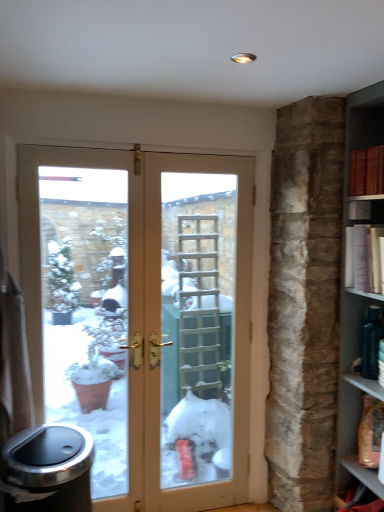
Question: Is red leather book at upper right, positioned as the 2th book in bottom-to-top order, at the right side of shiny metallic trash can at lower left?

Choices:
 (A) no
 (B) yes

Answer: (B)

Question: Is red leather book at upper right, positioned as the 2th book in bottom-to-top order, positioned before shiny metallic trash can at lower left?

Choices:
 (A) no
 (B) yes

Answer: (A)

Question: From a real-world perspective, is red leather book at upper right, the first book from the top, physically above shiny metallic trash can at lower left?

Choices:
 (A) no
 (B) yes

Answer: (B)

Question: From a real-world perspective, is red leather book at upper right, positioned as the 2th book in bottom-to-top order, located beneath shiny metallic trash can at lower left?

Choices:
 (A) no
 (B) yes

Answer: (A)

Question: Does red leather book at upper right, positioned as the 2th book in bottom-to-top order, have a smaller size compared to shiny metallic trash can at lower left?

Choices:
 (A) yes
 (B) no

Answer: (A)

Question: In terms of size, does shiny metallic trash can at lower left appear bigger or smaller than white paper bookshelf at right, which is the first book in bottom-to-top order?

Choices:
 (A) small
 (B) big

Answer: (B)

Question: From the image's perspective, is shiny metallic trash can at lower left positioned above or below white paper bookshelf at right, which is the first book in bottom-to-top order?

Choices:
 (A) below
 (B) above

Answer: (A)

Question: Visually, is shiny metallic trash can at lower left positioned to the left or to the right of white paper bookshelf at right, which is the first book in bottom-to-top order?

Choices:
 (A) left
 (B) right

Answer: (A)

Question: From a real-world perspective, is shiny metallic trash can at lower left positioned above or below white paper bookshelf at right, which is the first book in bottom-to-top order?

Choices:
 (A) below
 (B) above

Answer: (A)

Question: From their relative heights in the image, would you say red leather book at upper right, positioned as the 2th book in bottom-to-top order, is taller or shorter than matte brown wood at lower right?

Choices:
 (A) tall
 (B) short

Answer: (B)

Question: Choose the correct answer: Is red leather book at upper right, positioned as the 2th book in bottom-to-top order, inside matte brown wood at lower right or outside it?

Choices:
 (A) inside
 (B) outside

Answer: (B)

Question: Does point (367, 164) appear closer or farther from the camera than point (375, 484)?

Choices:
 (A) farther
 (B) closer

Answer: (A)

Question: In the image, is red leather book at upper right, the first book from the top, positioned in front of or behind matte brown wood at lower right?

Choices:
 (A) behind
 (B) front

Answer: (B)

Question: From their relative heights in the image, would you say shiny metallic trash can at lower left is taller or shorter than red leather book at upper right, positioned as the 2th book in bottom-to-top order?

Choices:
 (A) tall
 (B) short

Answer: (A)

Question: Visually, is shiny metallic trash can at lower left positioned to the left or to the right of red leather book at upper right, the first book from the top?

Choices:
 (A) right
 (B) left

Answer: (B)